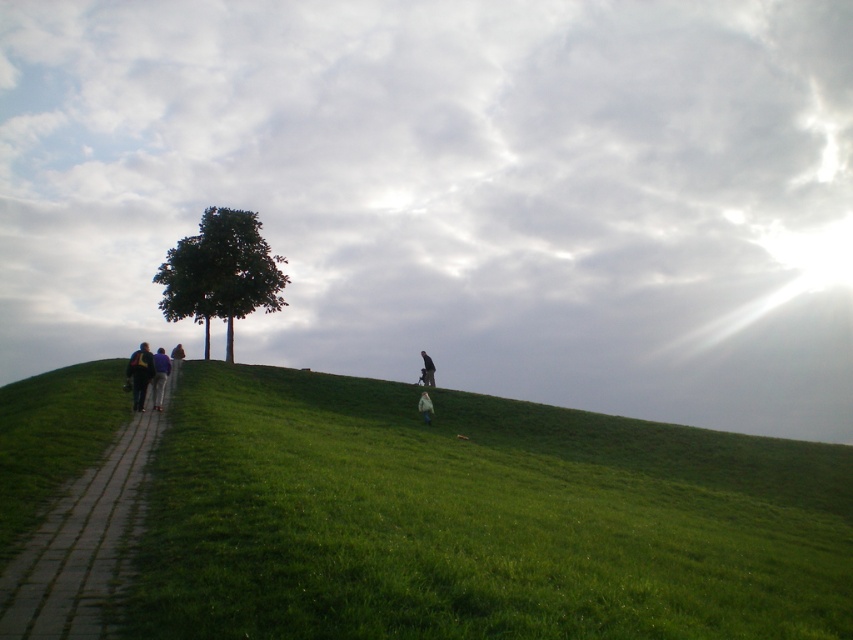
You are a hiker planning to walk up the paved stone path at lower left. You notice the dark blue jeans at left are taller than the path. What does this indicate about the path and the jeans?

The paved stone path at lower left has a lesser height compared to dark blue jeans at left, meaning the jeans are positioned higher up the hill than the path.

You are a photographer trying to capture the dark blue jeans at left and the light brown leather jacket at lower left in the same frame. Based on their positions, which object is wider in the image?

The dark blue jeans at left might be wider than light brown leather jacket at lower left.